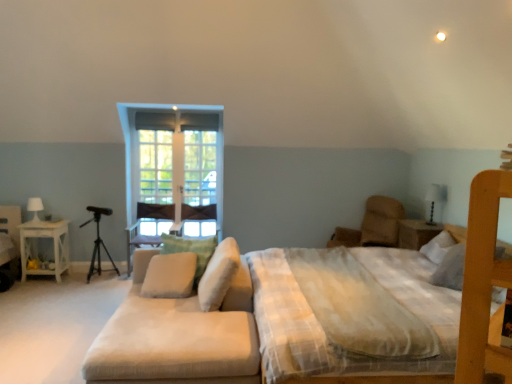
Question: From a real-world perspective, is beige fabric armchair at center positioned above or below beige fabric couch at lower left?

Choices:
 (A) above
 (B) below

Answer: (A)

Question: Is beige fabric armchair at center wider or thinner than beige fabric couch at lower left?

Choices:
 (A) wide
 (B) thin

Answer: (B)

Question: Which object is positioned farthest from the clear glass screen door at center?

Choices:
 (A) beige fabric pillow at center, the first pillow viewed from the left
 (B) white glossy table lamp at left, positioned as the 1th table lamp in back-to-front order
 (C) white wood nightstand at right, which appears as the 2th nightstand when viewed from the left
 (D) brown fabric swivel chair at center-right
 (E) beige fabric pillow at center, which is the 2th pillow in right-to-left order

Answer: (C)

Question: Based on their relative distances, which object is farther from the white glossy table lamp at upper right, which appears as the second table lamp when viewed from the left?

Choices:
 (A) beige fabric couch at lower left
 (B) clear glass screen door at center
 (C) beige fabric armchair at center
 (D) clear glass window at center
 (E) white soft mattress at center

Answer: (A)